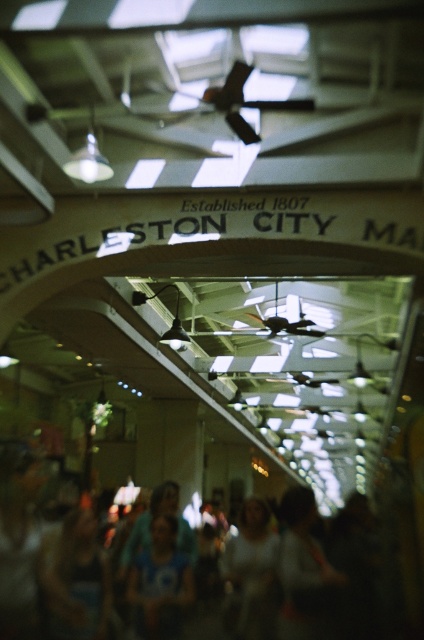
You are a photographer standing at the entrance of the Charleston City Market. You notice a blurred cotton crowd at lower center and a blue fabric shirt at center. Which object is closer to the camera?

The blurred cotton crowd at lower center is taller than the blue fabric shirt at center, so the blurred cotton crowd at lower center is closer to the camera.